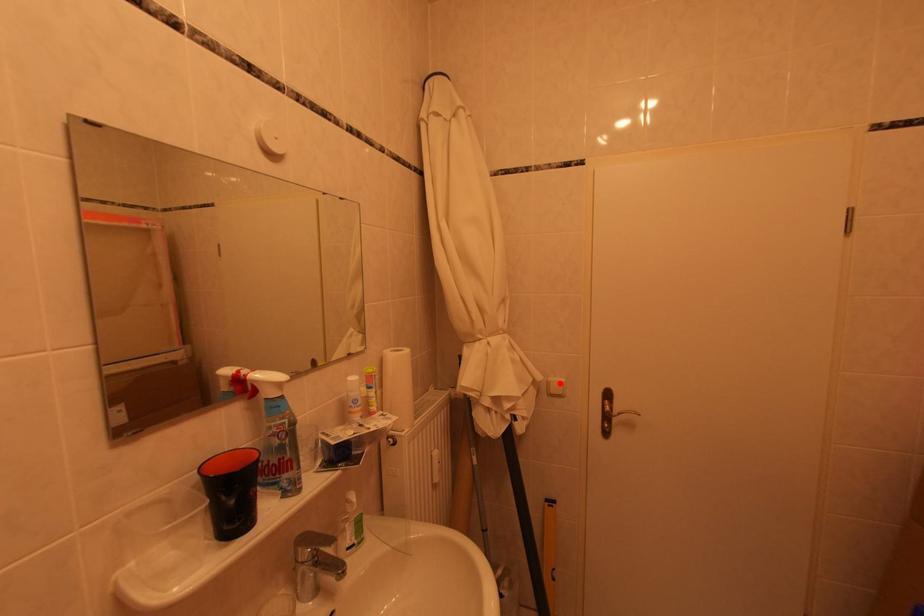
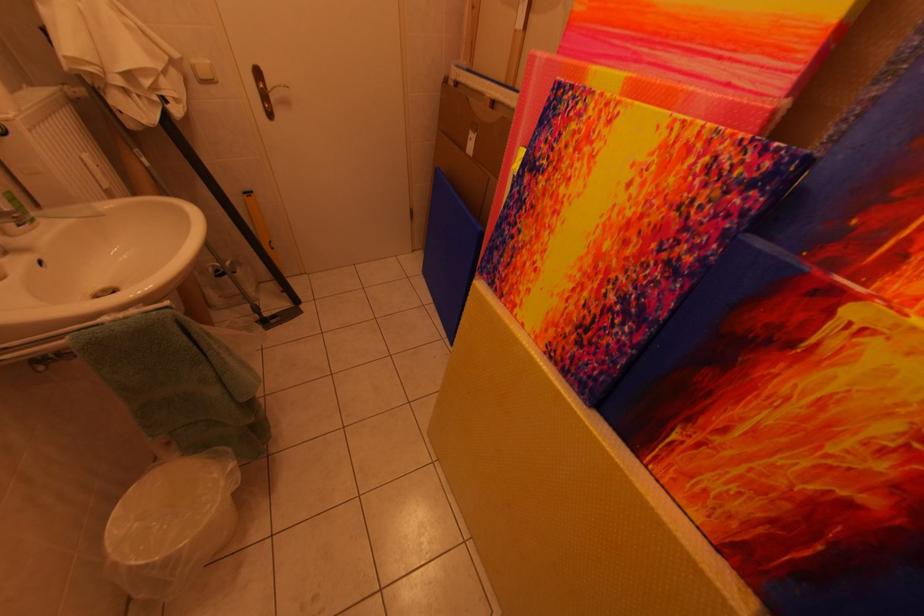
In the second image, find the point that corresponds to the highlighted location in the first image.

(203, 65)